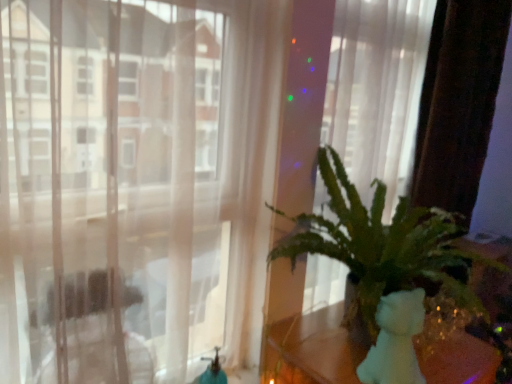
Question: Considering the relative sizes of white matte teddy bear at right and transparent curtain at center in the image provided, is white matte teddy bear at right thinner than transparent curtain at center?

Choices:
 (A) no
 (B) yes

Answer: (A)

Question: Is white matte teddy bear at right smaller than transparent curtain at center?

Choices:
 (A) no
 (B) yes

Answer: (B)

Question: Is transparent curtain at center located within white matte teddy bear at right?

Choices:
 (A) no
 (B) yes

Answer: (A)

Question: Does white matte teddy bear at right appear on the right side of transparent curtain at center?

Choices:
 (A) yes
 (B) no

Answer: (A)

Question: Is there a large distance between white matte teddy bear at right and transparent curtain at center?

Choices:
 (A) yes
 (B) no

Answer: (B)

Question: Considering the relative sizes of white matte teddy bear at right and transparent curtain at center in the image provided, is white matte teddy bear at right bigger than transparent curtain at center?

Choices:
 (A) no
 (B) yes

Answer: (A)

Question: Can you confirm if green leafy plant at right is taller than white matte teddy bear at right?

Choices:
 (A) yes
 (B) no

Answer: (A)

Question: Would you say green leafy plant at right contains white matte teddy bear at right?

Choices:
 (A) no
 (B) yes

Answer: (A)

Question: Is the depth of green leafy plant at right less than that of white matte teddy bear at right?

Choices:
 (A) yes
 (B) no

Answer: (A)

Question: Does green leafy plant at right appear on the left side of white matte teddy bear at right?

Choices:
 (A) no
 (B) yes

Answer: (A)

Question: Is there a large distance between green leafy plant at right and white matte teddy bear at right?

Choices:
 (A) yes
 (B) no

Answer: (B)

Question: From the image's perspective, does green leafy plant at right appear higher than white matte teddy bear at right?

Choices:
 (A) yes
 (B) no

Answer: (A)

Question: Would you say green leafy plant at right is a long distance from transparent curtain at center?

Choices:
 (A) yes
 (B) no

Answer: (B)